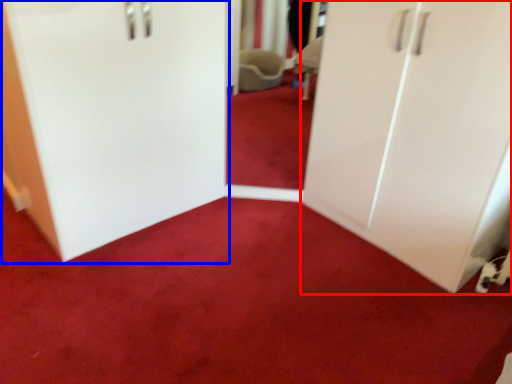
Question: Among these objects, which one is nearest to the camera, cupboard (highlighted by a red box) or door (highlighted by a blue box)?

Choices:
 (A) cupboard
 (B) door

Answer: (A)